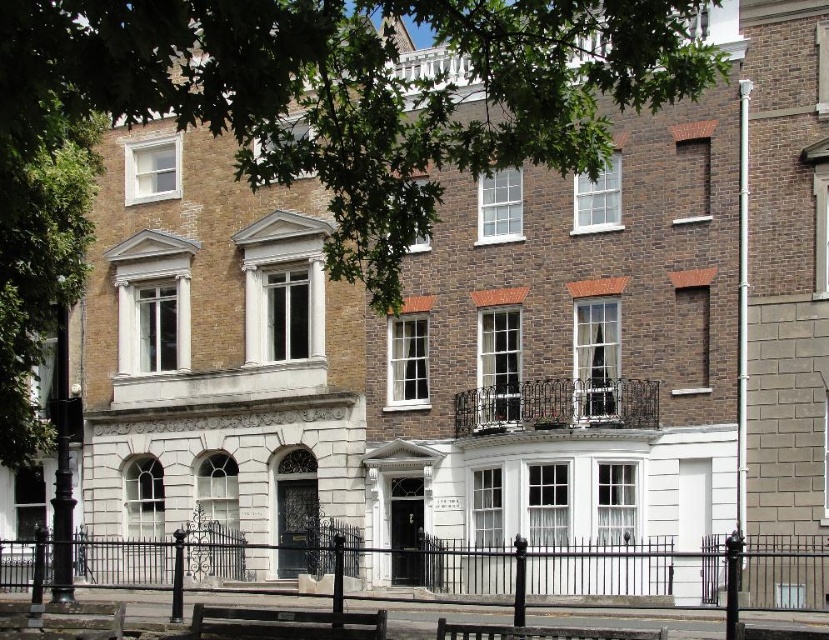
Question: Can you confirm if green leafy tree at upper center is wider than wooden park bench at lower center?

Choices:
 (A) no
 (B) yes

Answer: (B)

Question: Is green leafy tree at upper center positioned in front of black wrought iron fence at lower center?

Choices:
 (A) no
 (B) yes

Answer: (B)

Question: Is green leafy tree at upper center to the right of black wrought iron fence at lower center from the viewer's perspective?

Choices:
 (A) no
 (B) yes

Answer: (B)

Question: Which point is closer to the camera taking this photo?

Choices:
 (A) (551, 637)
 (B) (589, 582)
 (C) (32, 314)

Answer: (A)

Question: Which of the following is the farthest from the observer?

Choices:
 (A) (44, 321)
 (B) (662, 632)
 (C) (308, 625)

Answer: (A)

Question: Which point is closer to the camera taking this photo?

Choices:
 (A) (3, 212)
 (B) (326, 630)
 (C) (652, 630)

Answer: (B)